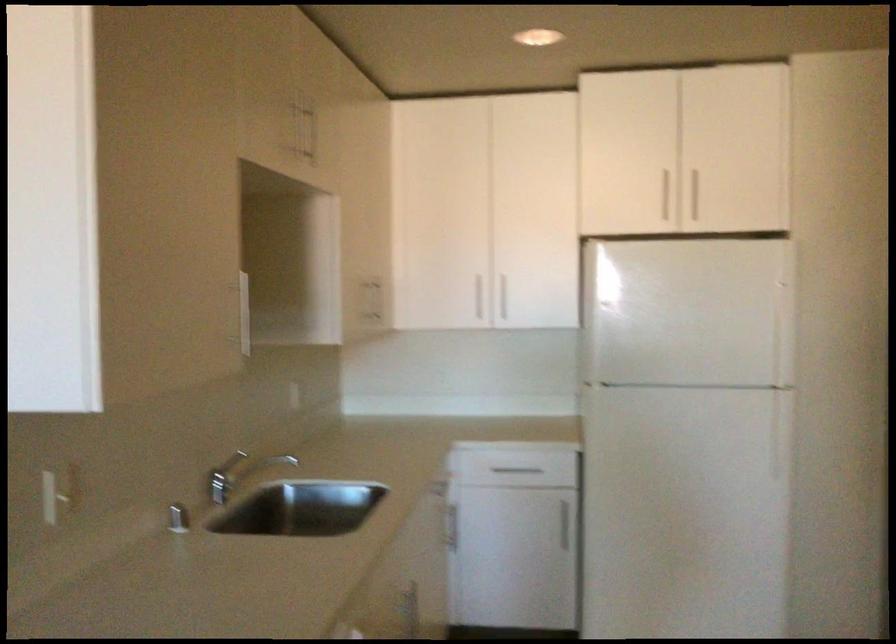
What do you see at coordinates (685, 512) in the screenshot?
I see `the refrigerator freezer door` at bounding box center [685, 512].